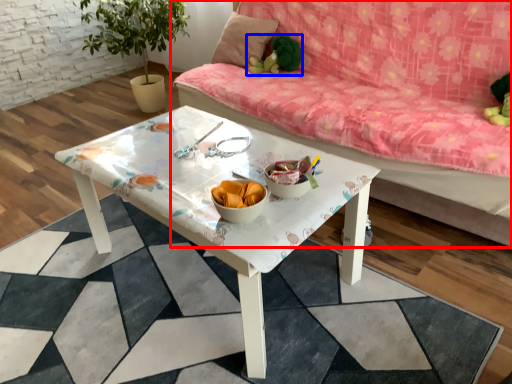
Question: Which of the following is the closest to the observer, studio couch (highlighted by a red box) or toy (highlighted by a blue box)?

Choices:
 (A) studio couch
 (B) toy

Answer: (A)